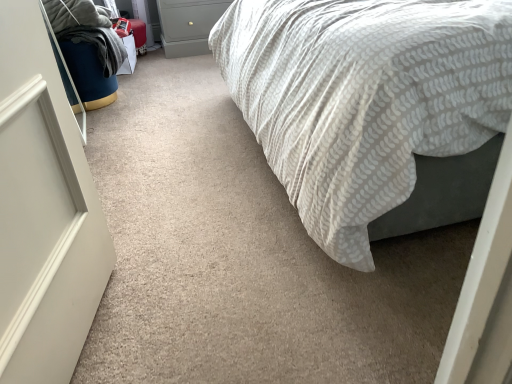
Question: From a real-world perspective, is matte gray drawer at upper center on velvet blue bean bag at left?

Choices:
 (A) yes
 (B) no

Answer: (A)

Question: Are matte gray drawer at upper center and velvet blue bean bag at left far apart?

Choices:
 (A) no
 (B) yes

Answer: (A)

Question: From the image's perspective, is matte gray drawer at upper center on velvet blue bean bag at left?

Choices:
 (A) yes
 (B) no

Answer: (A)

Question: Is matte gray drawer at upper center shorter than velvet blue bean bag at left?

Choices:
 (A) no
 (B) yes

Answer: (A)

Question: Does matte gray drawer at upper center appear on the right side of velvet blue bean bag at left?

Choices:
 (A) yes
 (B) no

Answer: (A)

Question: From the image's perspective, is matte gray drawer at upper center located beneath velvet blue bean bag at left?

Choices:
 (A) yes
 (B) no

Answer: (B)

Question: Is white textured fabric bed at center surrounding velvet blue bean bag at left?

Choices:
 (A) yes
 (B) no

Answer: (B)

Question: Is white textured fabric bed at center not close to velvet blue bean bag at left?

Choices:
 (A) no
 (B) yes

Answer: (B)

Question: Does white textured fabric bed at center have a greater height compared to velvet blue bean bag at left?

Choices:
 (A) no
 (B) yes

Answer: (B)

Question: Considering the relative positions of white textured fabric bed at center and velvet blue bean bag at left in the image provided, is white textured fabric bed at center to the left of velvet blue bean bag at left from the viewer's perspective?

Choices:
 (A) yes
 (B) no

Answer: (B)

Question: From a real-world perspective, is white textured fabric bed at center located beneath velvet blue bean bag at left?

Choices:
 (A) yes
 (B) no

Answer: (B)

Question: Is white textured fabric bed at center facing towards velvet blue bean bag at left?

Choices:
 (A) yes
 (B) no

Answer: (A)

Question: From a real-world perspective, is white textured fabric bed at center below matte gray drawer at upper center?

Choices:
 (A) yes
 (B) no

Answer: (B)